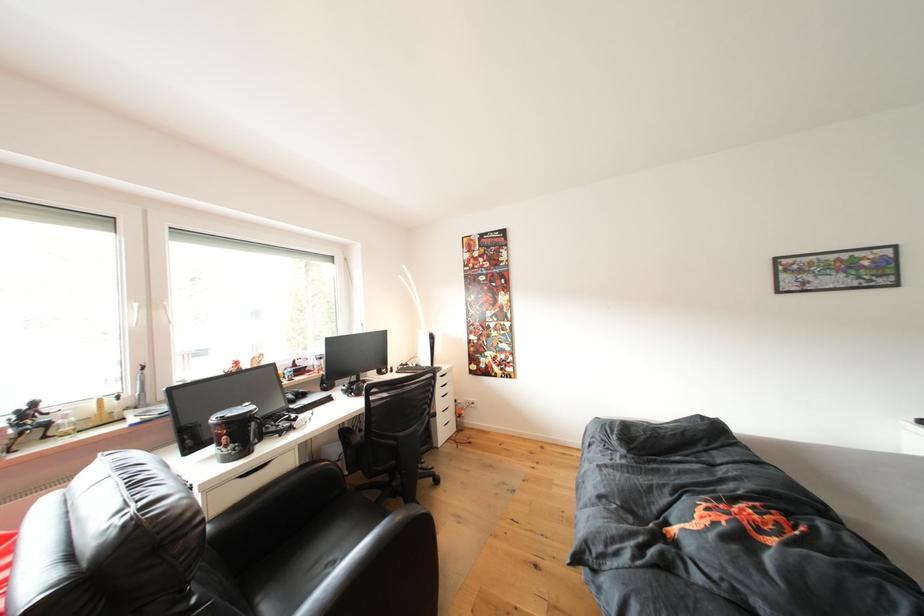
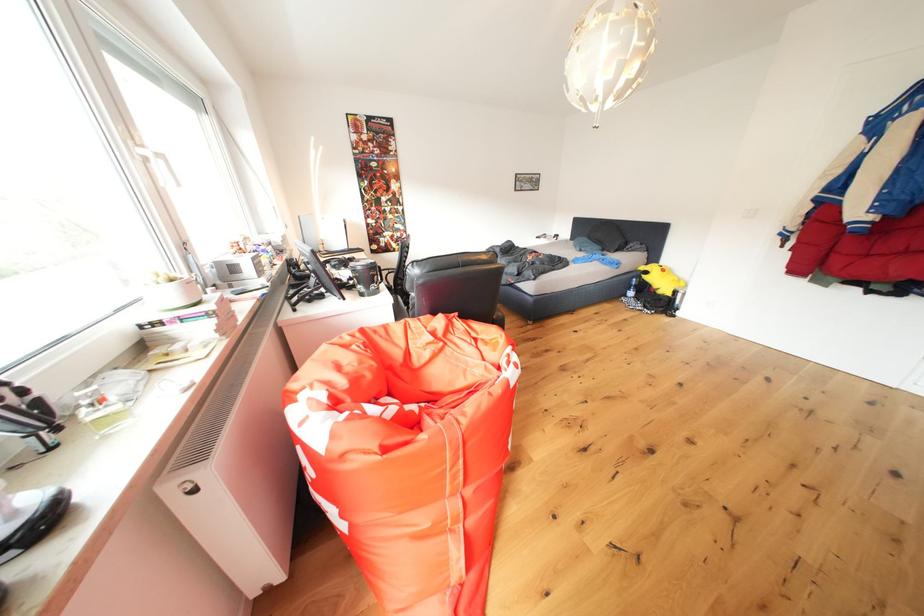
Question: I am providing you with two images of the same scene from different viewpoints. Please identify which objects are invisible in image2.

Choices:
 (A) white window handle
 (B) plastic water bottle
 (C) black mug handle
 (D) pink paper bag

Answer: (C)